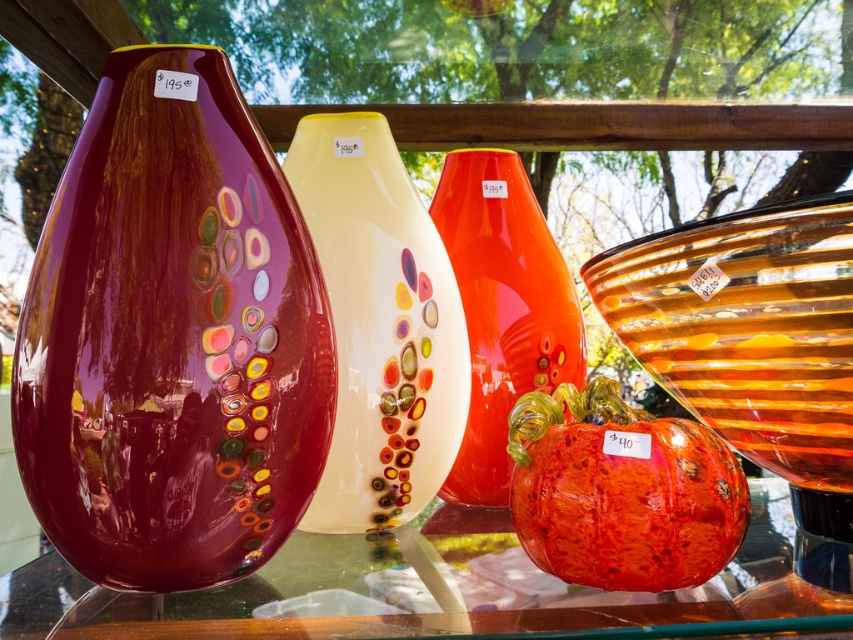
You are holding a camera and want to take a photo of the translucent amber glass bowl at right. If the camera has a minimum focus distance of 20 inches, will it be able to focus on the bowl without moving closer?

The camera and the translucent amber glass bowl at right are 21.18 inches apart. Since the minimum focus distance is 20 inches, the camera can focus on the bowl without moving closer because 21.18 inches is beyond the minimum requirement.

You are an artist trying to place a new sculpture in the center of the reflective surface where the translucent amber glass bowl at right is currently located. Can you move the bowl to the left to make space? Please explain based on its current position.

The translucent amber glass bowl at right is located at point (757, 362), which is on the right side of the reflective surface. Moving it to the left would require space, but without knowing the exact dimensions of the surface or other objects, it is uncertain if there is enough room. However, since it is at the rightmost position, there might be space to the left. Consider checking the available space before moving.

You are at an outdoor market and see two vases displayed on a reflective surface. The glossy glass vase at left and the translucent white vase at center. Which one has a wider base?

The glossy glass vase at left is wider than the translucent white vase at center, so it has a wider base.